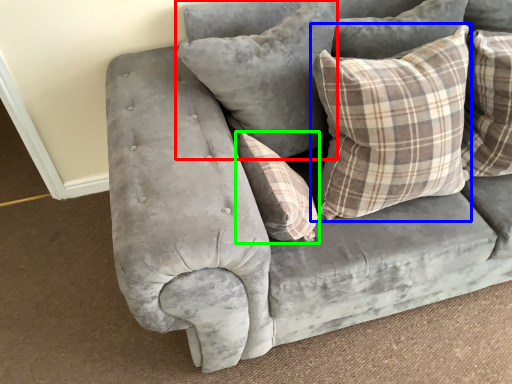
Question: Based on their relative distances, which object is nearer to pillow (highlighted by a red box)? Choose from pillow (highlighted by a blue box) and pillow (highlighted by a green box).

Choices:
 (A) pillow
 (B) pillow

Answer: (A)